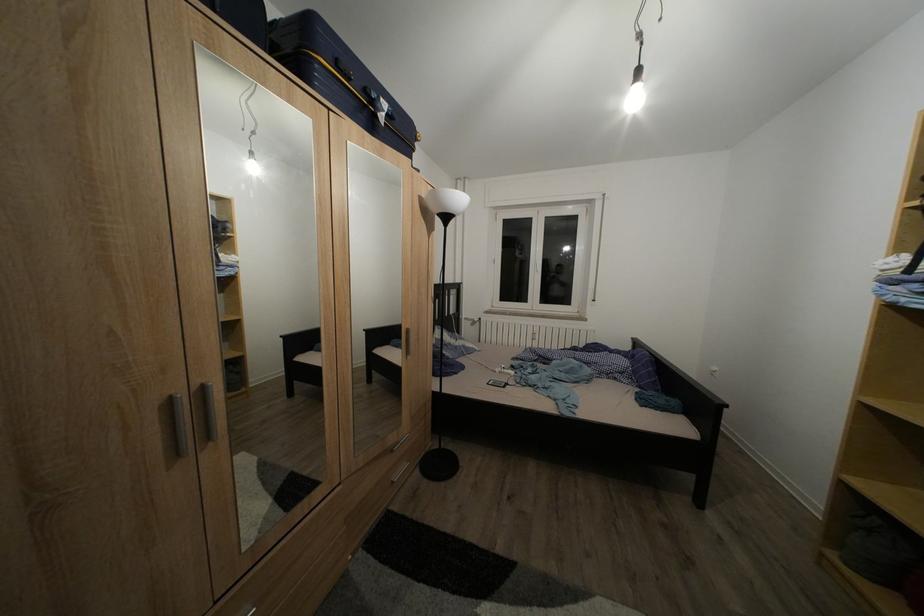
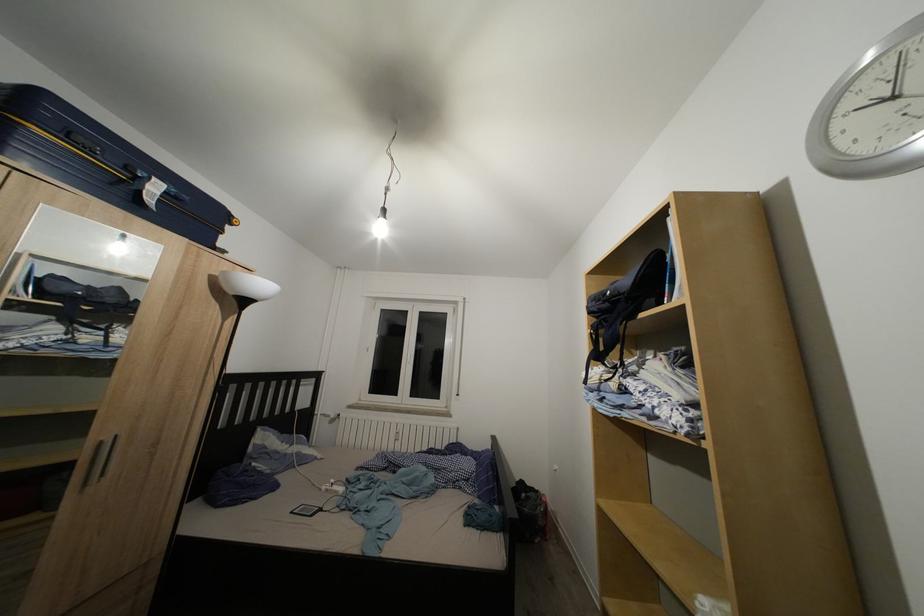
Question: The images are taken continuously from a first-person perspective. In which direction are you moving?

Choices:
 (A) Left
 (B) Right
 (C) Forward
 (D) Backward

Answer: (B)